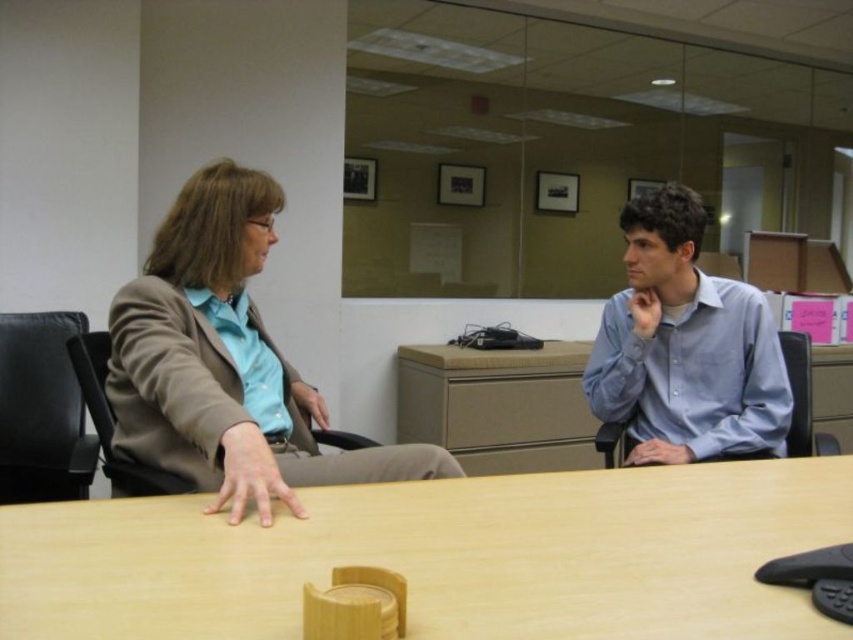
Question: Does matte brown blazer at left have a larger size compared to light blue shirt at center?

Choices:
 (A) no
 (B) yes

Answer: (B)

Question: Which object is positioned closest to the light blue shirt at center?

Choices:
 (A) matte brown blazer at left
 (B) wooden at center

Answer: (B)

Question: Does wooden at center have a smaller size compared to light blue shirt at center?

Choices:
 (A) no
 (B) yes

Answer: (B)

Question: Is matte brown blazer at left positioned at the back of light blue shirt at center?

Choices:
 (A) yes
 (B) no

Answer: (B)

Question: Among these points, which one is nearest to the camera?

Choices:
 (A) (239, 384)
 (B) (433, 483)
 (C) (659, 241)

Answer: (B)

Question: Which object is farther from the camera taking this photo?

Choices:
 (A) light blue shirt at center
 (B) wooden at center
 (C) matte brown blazer at left

Answer: (A)